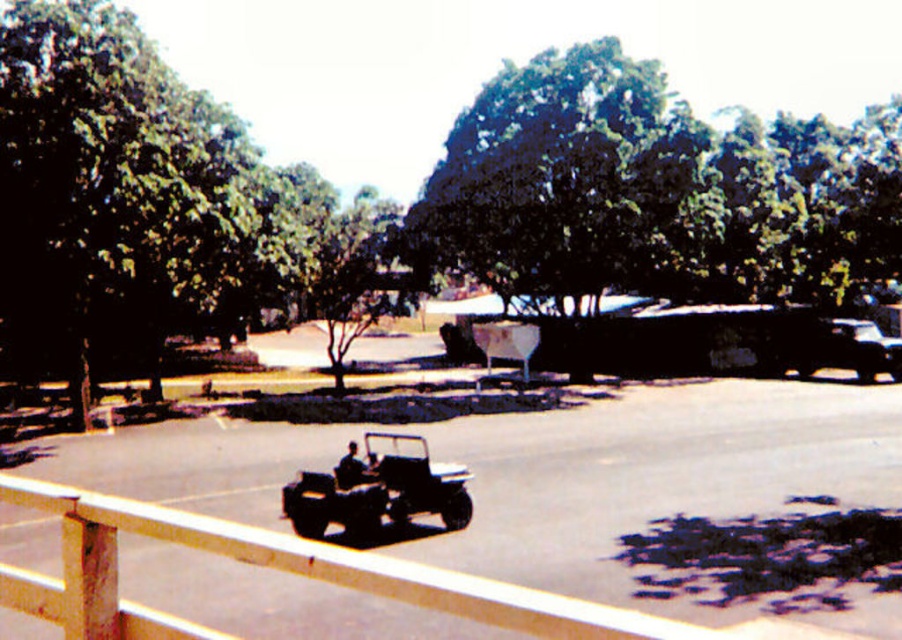
You are standing on a balcony and want to take a photo of the green leafy tree at center and the wooden fence at lower center. Which object will appear bigger in your photo?

The green leafy tree at center will appear bigger in the photo because it is larger in size than the wooden fence at lower center.

You are standing at the point with coordinates point (x=95, y=637) and want to walk to the point with coordinates point (x=81, y=205). According to the scene, will you have to walk towards the vehicle or away from it?

Point (x=81, y=205) is behind point (x=95, y=637). Since the vehicle is in the center of the image, walking towards the vehicle would mean moving towards the center. However, since point (x=81, y=205) is behind point (x=95, y=637), you would need to walk away from the vehicle to reach it.